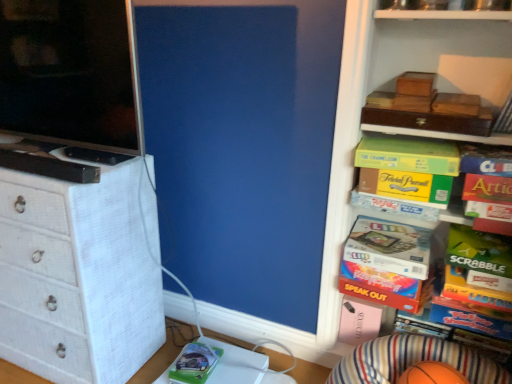
Locate an element on the screen. The height and width of the screenshot is (384, 512). free point to the right of green matte comic book at lower center is located at coordinates (233, 366).